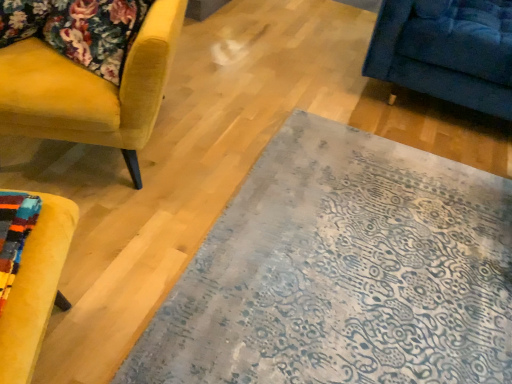
Question: Is point (219, 352) positioned closer to the camera than point (130, 82)?

Choices:
 (A) closer
 (B) farther

Answer: (A)

Question: From a real-world perspective, is blue-patterned rug at center above or below velvet yellow armchair at left?

Choices:
 (A) above
 (B) below

Answer: (B)

Question: Which of these objects is positioned farthest from the velvet yellow armchair at left?

Choices:
 (A) blue-patterned rug at center
 (B) velvet floral cushion at upper left

Answer: (A)

Question: Which is nearer to the blue-patterned rug at center?

Choices:
 (A) velvet floral cushion at upper left
 (B) velvet yellow armchair at left

Answer: (B)